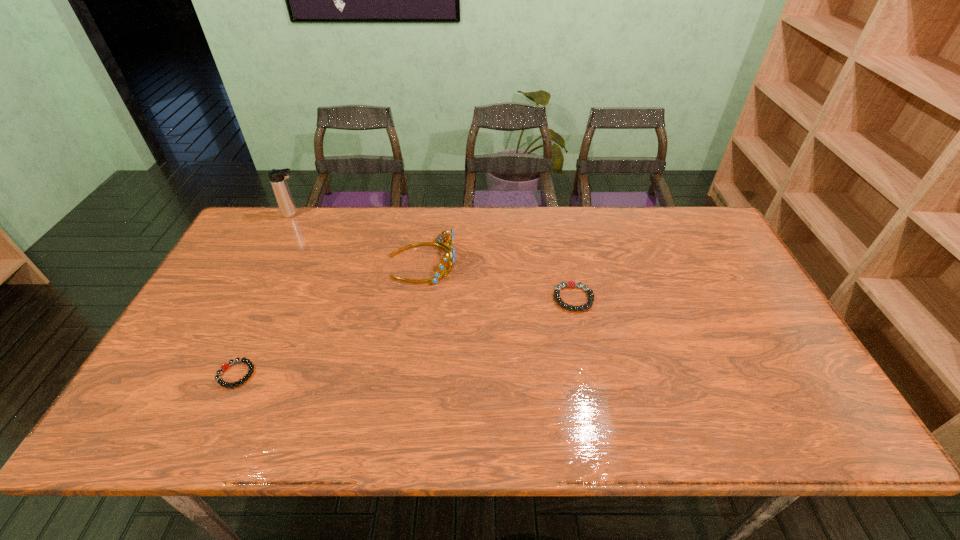
Identify the location of vacant space situated on the left of the rightmost object. (465, 298).

What are the coordinates of `vacant region located 0.240m on the back of the shortest object` in the screenshot? It's located at tap(275, 291).

This screenshot has height=540, width=960. What are the coordinates of `thermos bottle that is at the far edge` in the screenshot? It's located at (277, 177).

At what (x,y) coordinates should I click in order to perform the action: click on tiara that is at the far edge. Please return your answer as a coordinate pair (x, y). Looking at the image, I should click on (438, 274).

Locate an element on the screen. The width and height of the screenshot is (960, 540). thermos bottle located in the left edge section of the desktop is located at coordinates (277, 177).

Find the location of a particular element. This screenshot has width=960, height=540. bracelet that is positioned at the left edge is located at coordinates (250, 365).

The width and height of the screenshot is (960, 540). I want to click on object situated at the far left corner, so [277, 177].

Locate an element on the screen. free region at the far edge of the desktop is located at coordinates pyautogui.click(x=656, y=212).

Image resolution: width=960 pixels, height=540 pixels. Identify the location of vacant space at the near edge. point(385,406).

Where is `free space at the right edge of the desktop`? free space at the right edge of the desktop is located at coordinates (775, 368).